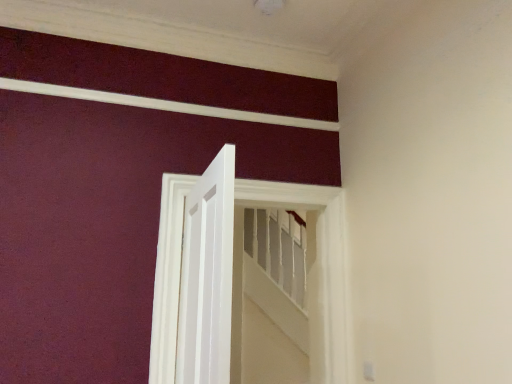
What do you see at coordinates (207, 276) in the screenshot?
I see `white smooth door at center` at bounding box center [207, 276].

At what (x,y) coordinates should I click in order to perform the action: click on white smooth door at center. Please return your answer as a coordinate pair (x, y). Looking at the image, I should click on (207, 276).

This screenshot has width=512, height=384. Identify the location of white smooth door at center. (207, 276).